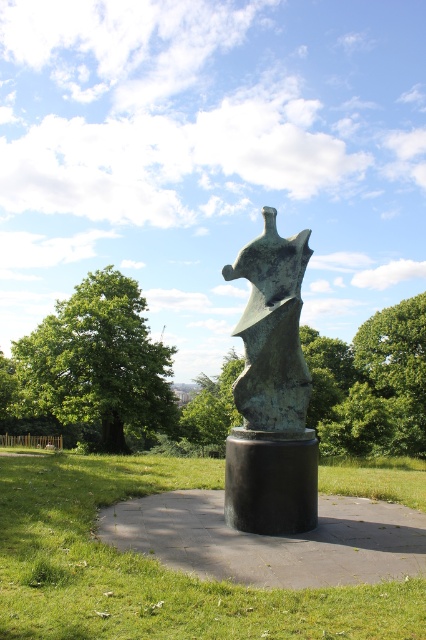
You are standing in the park and want to take a photo of the sculpture without the green leafy tree at left blocking the view. Based on the coordinates provided, can you position yourself to the right of the tree to ensure the sculpture is fully visible?

The green leafy tree at left is located at point (97, 362). Positioning yourself to the right of this coordinate should allow the sculpture to be fully visible without obstruction from the tree.

You are standing at point (371, 384) in the park. What do you see around you?

At point (371, 384), you are surrounded by the green leafy tree at center.

You are standing in the park and see the sculpture mounted on its dark pedestal. There is a spot marked at point (154, 566). What is located at that point?

The point (154, 566) is at the center of the sculpture and has green grass there.